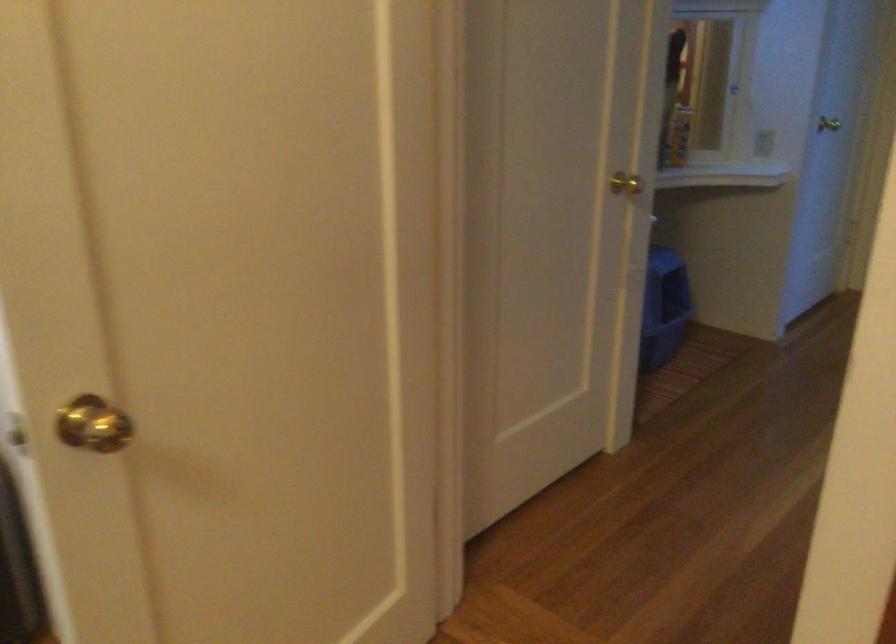
Where is `blue litter box`? This screenshot has height=644, width=896. blue litter box is located at coordinates (664, 308).